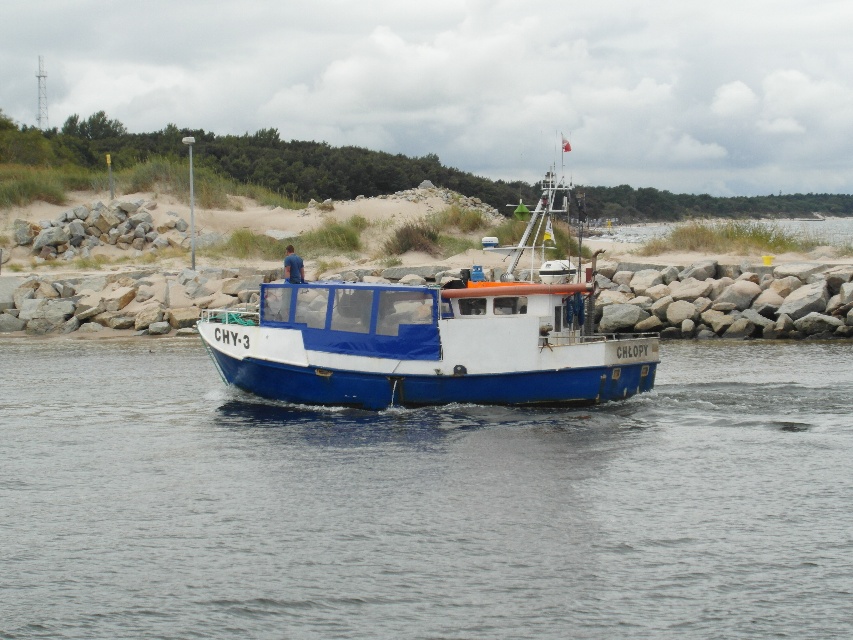
Question: Which point is farther from the camera taking this photo?

Choices:
 (A) (640, 346)
 (B) (746, 518)

Answer: (A)

Question: Among these objects, which one is nearest to the camera?

Choices:
 (A) blue matte boat at center
 (B) blue matte water at center

Answer: (B)

Question: Can you confirm if blue matte water at center is thinner than blue matte boat at center?

Choices:
 (A) no
 (B) yes

Answer: (A)

Question: Is blue matte water at center bigger than blue matte boat at center?

Choices:
 (A) yes
 (B) no

Answer: (B)

Question: Which point appears closest to the camera in this image?

Choices:
 (A) (444, 316)
 (B) (18, 612)

Answer: (B)

Question: Does blue matte water at center have a greater width compared to blue matte boat at center?

Choices:
 (A) no
 (B) yes

Answer: (B)